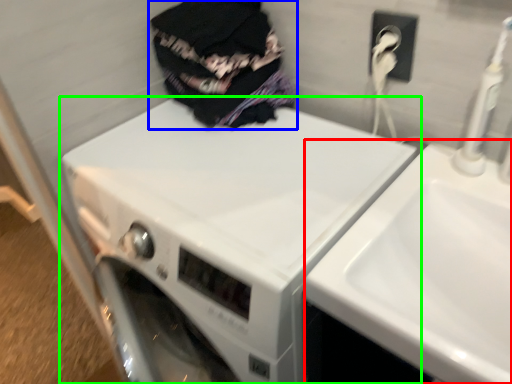
Question: Which object is positioned closest to sink (highlighted by a red box)? Select from clothing (highlighted by a blue box) and washing machine (highlighted by a green box).

Choices:
 (A) clothing
 (B) washing machine

Answer: (B)